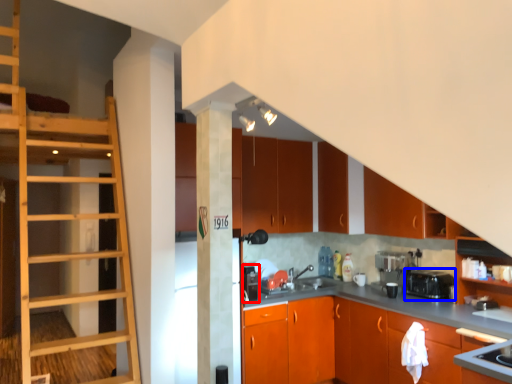
Question: Which point is closer to the camera, appliance (highlighted by a red box) or appliance (highlighted by a blue box)?

Choices:
 (A) appliance
 (B) appliance

Answer: (B)